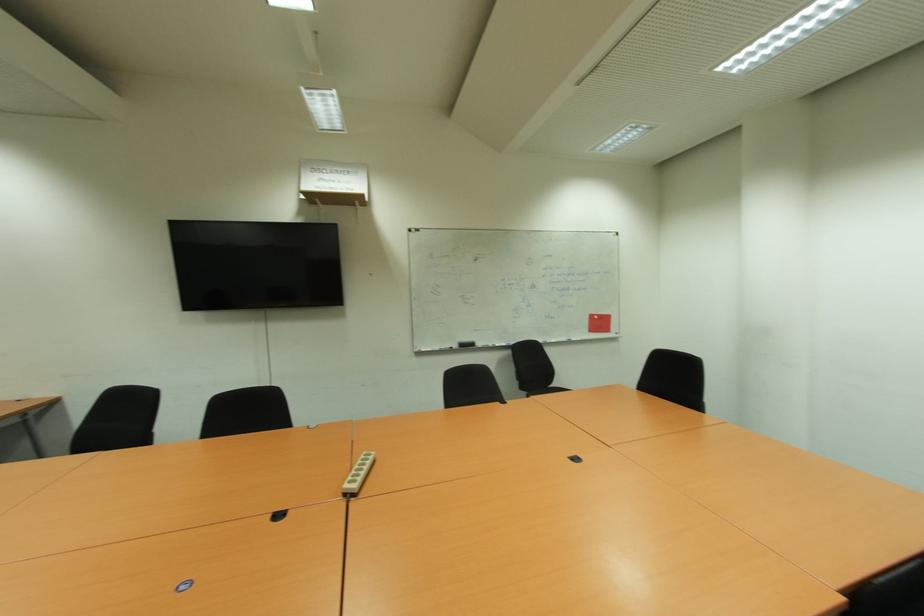
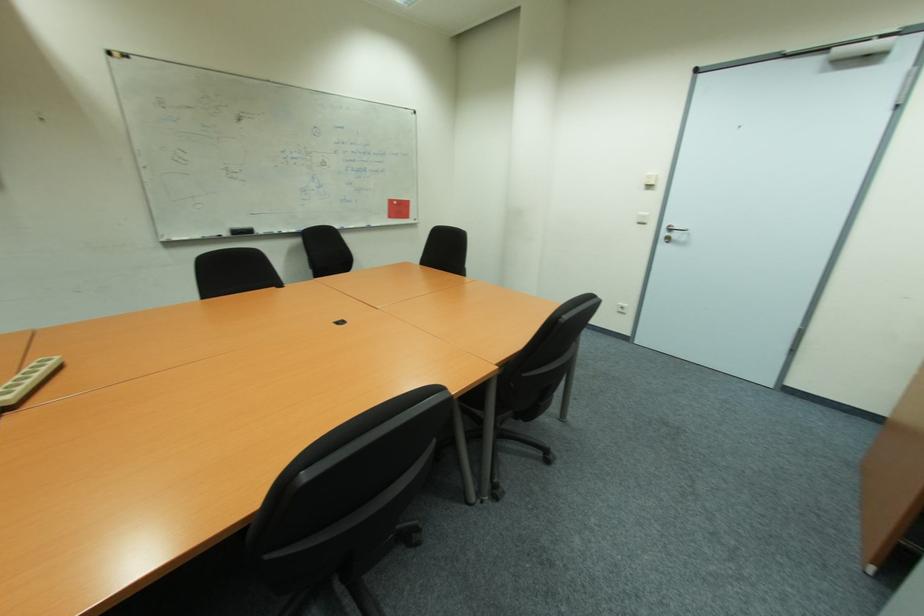
First-person continuous shooting, in which direction is the camera rotating?

The rotation direction of the camera is right-down.